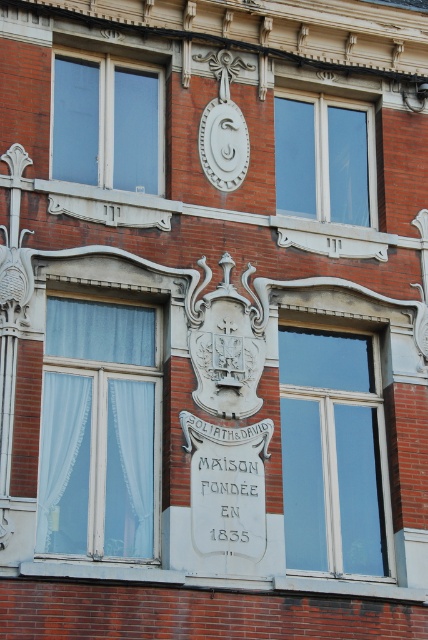
Does point (142, 125) come closer to viewer compared to point (359, 204)?

Yes, it is.

Is transparent glass window at upper left taller than clear glass window at upper center?

Yes, transparent glass window at upper left is taller than clear glass window at upper center.

The width and height of the screenshot is (428, 640). What do you see at coordinates (107, 124) in the screenshot?
I see `transparent glass window at upper left` at bounding box center [107, 124].

This screenshot has height=640, width=428. In order to click on transparent glass window at upper left in this screenshot , I will do `click(107, 124)`.

Which is above, clear glass window at upper center or white matte clock at upper center?

white matte clock at upper center is higher up.

Is point (353, 157) positioned behind point (238, 184)?

Yes, it is behind point (238, 184).

In order to click on clear glass window at upper center in this screenshot , I will do click(323, 161).

Is transparent glass window at upper left positioned behind white matte clock at upper center?

No.

You are a GUI agent. You are given a task and a screenshot of the screen. Output one action in this format:
    pyautogui.click(x=<x>, y=<y>)
    Task: Click on the transparent glass window at upper left
    This screenshot has width=428, height=640.
    Given the screenshot: What is the action you would take?
    pyautogui.click(x=107, y=124)

You are a GUI agent. You are given a task and a screenshot of the screen. Output one action in this format:
    pyautogui.click(x=<x>, y=<y>)
    Task: Click on the transparent glass window at upper left
    
    Given the screenshot: What is the action you would take?
    pyautogui.click(x=107, y=124)

At what (x,y) coordinates should I click in order to perform the action: click on transparent glass window at upper left. Please return your answer as a coordinate pair (x, y). Looking at the image, I should click on (107, 124).